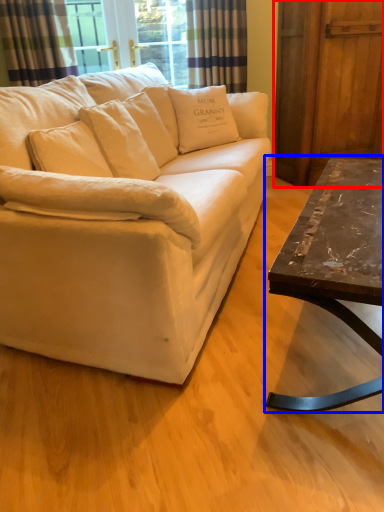
Question: Which object is closer to the camera taking this photo, barn door (highlighted by a red box) or coffee table (highlighted by a blue box)?

Choices:
 (A) barn door
 (B) coffee table

Answer: (B)